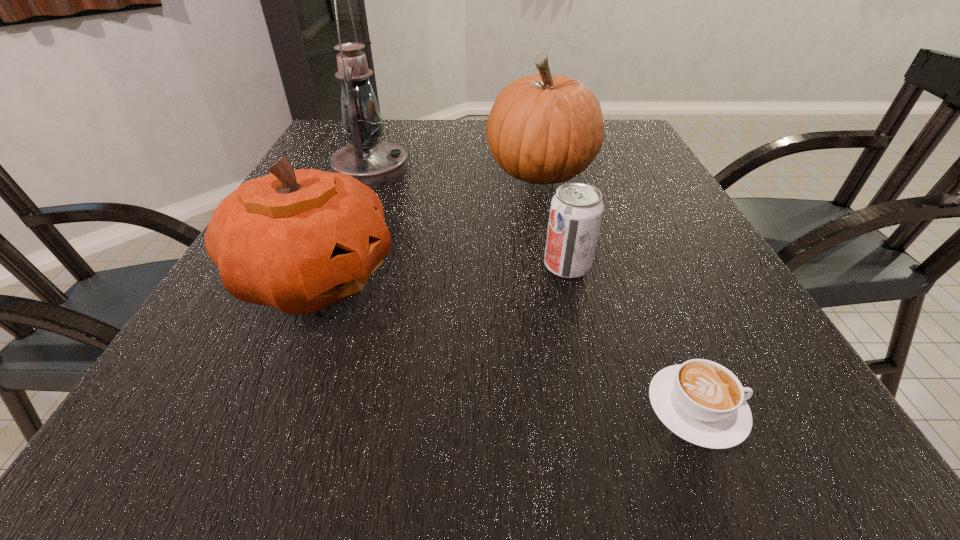
Identify the location of free space between the fourth tallest object and the left pumpkin. (441, 272).

Identify the location of unoccupied area between the oil lamp and the right pumpkin. The height and width of the screenshot is (540, 960). (455, 172).

You are a GUI agent. You are given a task and a screenshot of the screen. Output one action in this format:
    pyautogui.click(x=<x>, y=<y>)
    Task: Click on the free space between the taller pumpkin and the shortest object
    This screenshot has height=540, width=960.
    Given the screenshot: What is the action you would take?
    pyautogui.click(x=618, y=291)

This screenshot has height=540, width=960. What are the coordinates of `free area in between the taller pumpkin and the nearer pumpkin` in the screenshot? It's located at (427, 225).

I want to click on free spot between the tallest object and the shortest object, so tap(534, 289).

Identify the location of empty location between the cappuccino and the tallest object. (534, 289).

Where is `object identified as the closest to the third tallest object`? object identified as the closest to the third tallest object is located at coordinates (375, 163).

Locate an element on the screen. The width and height of the screenshot is (960, 540). the third closest object to the shorter pumpkin is located at coordinates (576, 210).

Locate an element on the screen. This screenshot has height=540, width=960. vacant space that satisfies the following two spatial constraints: 1. on the stem of the soda can; 2. on the right side of the taller pumpkin is located at coordinates (560, 266).

At what (x,y) coordinates should I click in order to perform the action: click on vacant region that satisfies the following two spatial constraints: 1. on the stem of the soda can; 2. on the left side of the farther pumpkin. Please return your answer as a coordinate pair (x, y). Image resolution: width=960 pixels, height=540 pixels. Looking at the image, I should click on (560, 266).